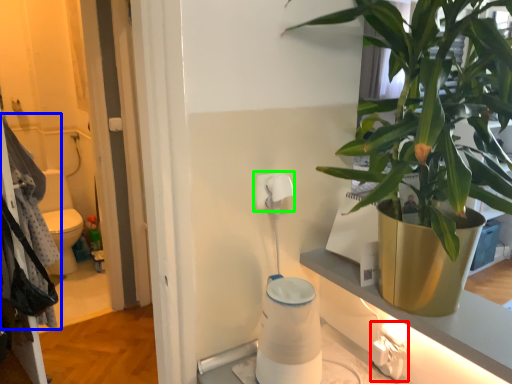
Question: Based on their relative distances, which object is farther from electric outlet (highlighted by a red box)? Choose from laundry (highlighted by a blue box) and toilet paper (highlighted by a green box).

Choices:
 (A) laundry
 (B) toilet paper

Answer: (A)